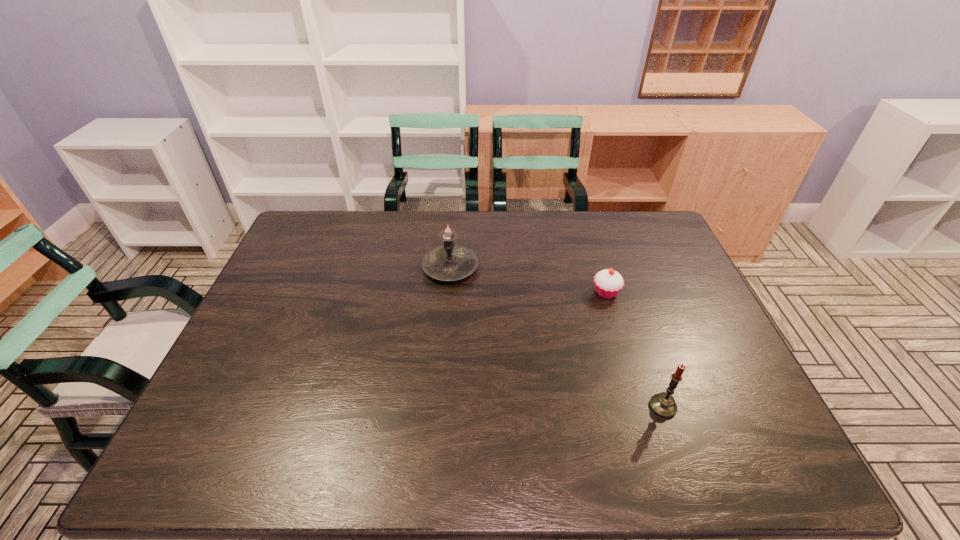
Identify the location of the leftmost object. Image resolution: width=960 pixels, height=540 pixels. (449, 262).

At what (x,y) coordinates should I click in order to perform the action: click on the left candle. Please return your answer as a coordinate pair (x, y). Looking at the image, I should click on (449, 262).

Where is `the nearest object`? This screenshot has height=540, width=960. the nearest object is located at coordinates (663, 404).

Identify the location of the nearer candle. (663, 404).

This screenshot has width=960, height=540. In order to click on cupcake in this screenshot , I will do `click(608, 283)`.

Where is `free location located on the back of the left candle`? The width and height of the screenshot is (960, 540). free location located on the back of the left candle is located at coordinates (454, 218).

Image resolution: width=960 pixels, height=540 pixels. What are the coordinates of `free space located on the left of the nearer candle` in the screenshot? It's located at (510, 407).

The image size is (960, 540). Find the location of `free space located 0.280m on the back of the shortest object`. free space located 0.280m on the back of the shortest object is located at coordinates (587, 230).

Locate an element on the screen. Image resolution: width=960 pixels, height=540 pixels. object at the far edge is located at coordinates (449, 262).

Locate an element on the screen. The width and height of the screenshot is (960, 540). vacant region at the far edge of the desktop is located at coordinates (472, 226).